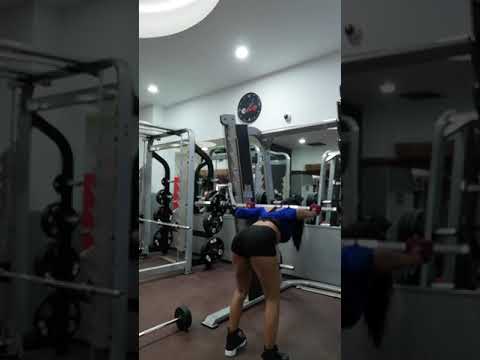
The image size is (480, 360). I want to click on floor, so click(203, 298).